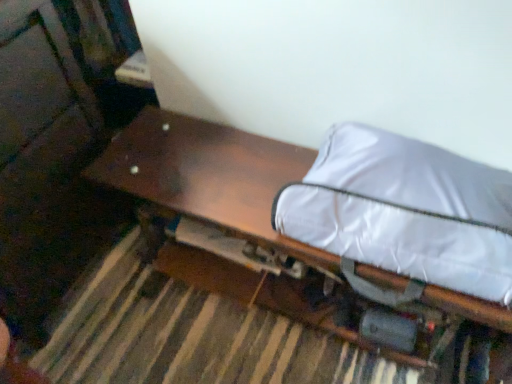
At what (x,y) coordinates should I click in order to perform the action: click on wooden bench at center. Please return your answer as a coordinate pair (x, y). The image size is (512, 384). Looking at the image, I should click on (207, 173).

What do you see at coordinates (207, 173) in the screenshot? This screenshot has height=384, width=512. I see `wooden bench at center` at bounding box center [207, 173].

From the picture: In order to face white fabric bean bag at right, should I rotate leftwards or rightwards?

Turn right by 18.766 degrees to look at white fabric bean bag at right.

Image resolution: width=512 pixels, height=384 pixels. What do you see at coordinates (405, 211) in the screenshot?
I see `white fabric bean bag at right` at bounding box center [405, 211].

In order to click on white fabric bean bag at right in this screenshot , I will do `click(405, 211)`.

Where is `wooden bench at center`? The height and width of the screenshot is (384, 512). wooden bench at center is located at coordinates (207, 173).

Based on the photo, which object is positioned more to the right, wooden bench at center or white fabric bean bag at right?

From the viewer's perspective, white fabric bean bag at right appears more on the right side.

Which is behind, wooden bench at center or white fabric bean bag at right?

wooden bench at center is more distant.

Which is in front, point (174, 169) or point (505, 255)?

The point (505, 255) is closer to the camera.

From the image's perspective, is wooden bench at center under white fabric bean bag at right?

Yes, from the image's perspective, wooden bench at center is below white fabric bean bag at right.

From a real-world perspective, who is located lower, wooden bench at center or white fabric bean bag at right?

From a 3D spatial view, wooden bench at center is below.

From the picture: Is wooden bench at center thinner than white fabric bean bag at right?

No.

Considering the sizes of wooden bench at center and white fabric bean bag at right in the image, is wooden bench at center taller or shorter than white fabric bean bag at right?

wooden bench at center is taller than white fabric bean bag at right.

Who is bigger, wooden bench at center or white fabric bean bag at right?

wooden bench at center.

Choose the correct answer: Is wooden bench at center inside white fabric bean bag at right or outside it?

wooden bench at center cannot be found inside white fabric bean bag at right.

Is wooden bench at center beside white fabric bean bag at right?

No, wooden bench at center is not touching white fabric bean bag at right.

Is white fabric bean bag at right at the back of wooden bench at center?

No, wooden bench at center's orientation is not away from white fabric bean bag at right.

Can you tell me how much wooden bench at center and white fabric bean bag at right differ in facing direction?

The angle between the facing direction of wooden bench at center and the facing direction of white fabric bean bag at right is 0.000319 degrees.

This screenshot has width=512, height=384. Identify the location of furniture behind the white fabric bean bag at right. (207, 173).

Which is more to the right, white fabric bean bag at right or wooden bench at center?

white fabric bean bag at right is more to the right.

Considering the positions of objects white fabric bean bag at right and wooden bench at center in the image provided, who is in front, white fabric bean bag at right or wooden bench at center?

white fabric bean bag at right is more forward.

Considering the positions of points (371, 272) and (433, 295), is point (371, 272) closer to camera compared to point (433, 295)?

No, it is behind (433, 295).

From the image's perspective, who appears lower, white fabric bean bag at right or wooden bench at center?

From the image's view, wooden bench at center is below.

From a real-world perspective, which is physically below, white fabric bean bag at right or wooden bench at center?

wooden bench at center.

Considering the relative sizes of white fabric bean bag at right and wooden bench at center in the image provided, is white fabric bean bag at right wider than wooden bench at center?

Incorrect, the width of white fabric bean bag at right does not surpass that of wooden bench at center.

Considering the sizes of objects white fabric bean bag at right and wooden bench at center in the image provided, who is shorter, white fabric bean bag at right or wooden bench at center?

white fabric bean bag at right is shorter.

In terms of size, does white fabric bean bag at right appear bigger or smaller than wooden bench at center?

white fabric bean bag at right is smaller than wooden bench at center.

Would you say wooden bench at center is part of white fabric bean bag at right's contents?

No, white fabric bean bag at right does not contain wooden bench at center.

Looking at this image, is white fabric bean bag at right placed right next to wooden bench at center?

white fabric bean bag at right is not next to wooden bench at center, and they're not touching.

Is white fabric bean bag at right looking in the opposite direction of wooden bench at center?

No.

Looking at this image, how different are the orientations of white fabric bean bag at right and wooden bench at center in degrees?

They differ by 0.000319 degrees in their facing directions.

I want to click on furniture lying behind the white fabric bean bag at right, so click(207, 173).

The height and width of the screenshot is (384, 512). I want to click on bean bag chair lying above the wooden bench at center (from the image's perspective), so click(405, 211).

The width and height of the screenshot is (512, 384). Find the location of `bean bag chair in front of the wooden bench at center`. bean bag chair in front of the wooden bench at center is located at coordinates (405, 211).